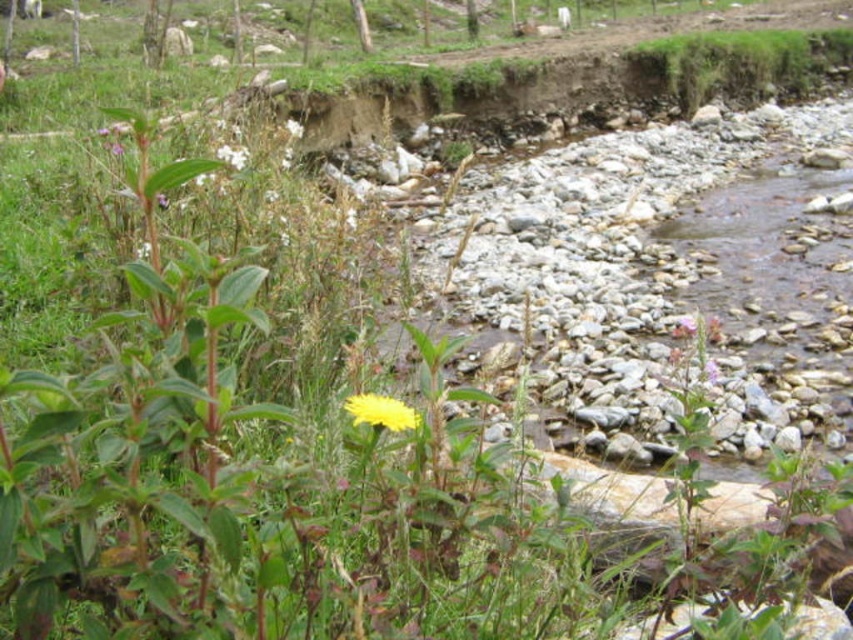
You are a bee searching for flowers to pollinate. You see the yellow matte flower at center and the white fluffy flower at upper left. Which flower is located to the right of the other?

The yellow matte flower at center is positioned on the right side of white fluffy flower at upper left.